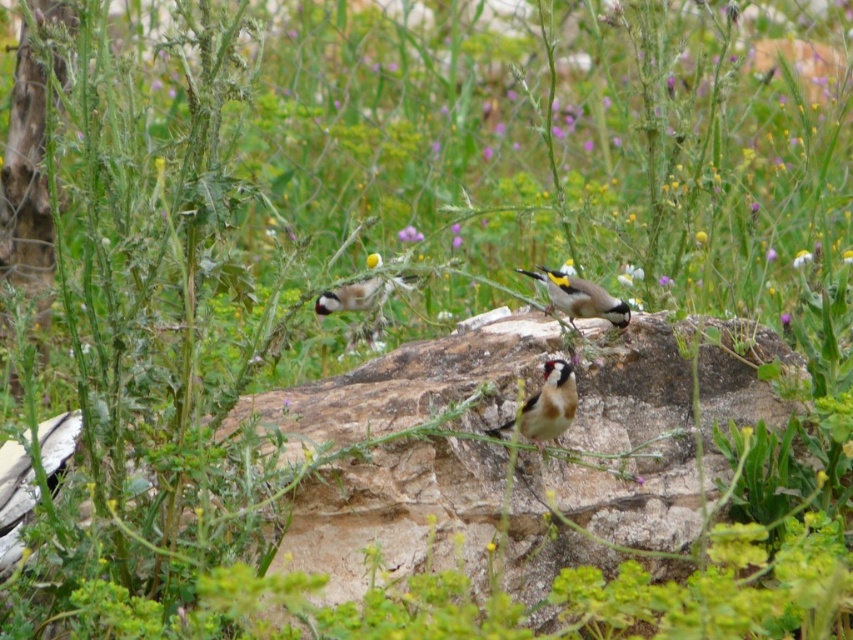
Question: Does yellow and white speckled bird at center appear under purple matte flower at center?

Choices:
 (A) yes
 (B) no

Answer: (A)

Question: Where is golden-yellow feathers at center located in relation to yellow-green petal at center in the image?

Choices:
 (A) right
 (B) left

Answer: (B)

Question: Which point is farther from the camera taking this photo?

Choices:
 (A) (379, 304)
 (B) (809, 260)
 (C) (550, 358)
 (D) (373, 266)

Answer: (D)

Question: Among these points, which one is nearest to the camera?

Choices:
 (A) (383, 300)
 (B) (399, 236)

Answer: (A)

Question: Does purple matte flower at center have a greater width compared to yellow-green petal at center?

Choices:
 (A) yes
 (B) no

Answer: (B)

Question: Among these objects, which one is nearest to the camera?

Choices:
 (A) yellow-green petal at center
 (B) golden-yellow feathers at center
 (C) purple matte flower at center

Answer: (B)